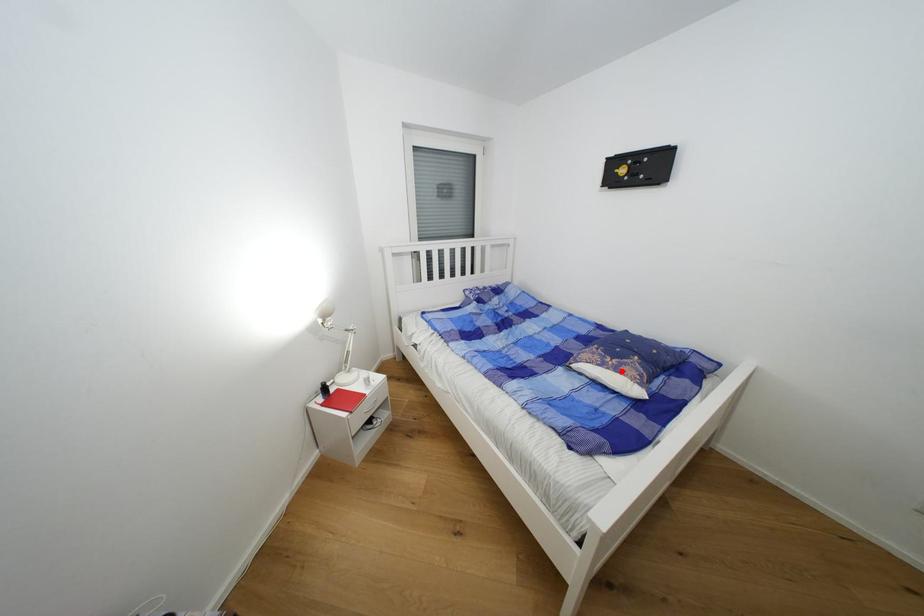
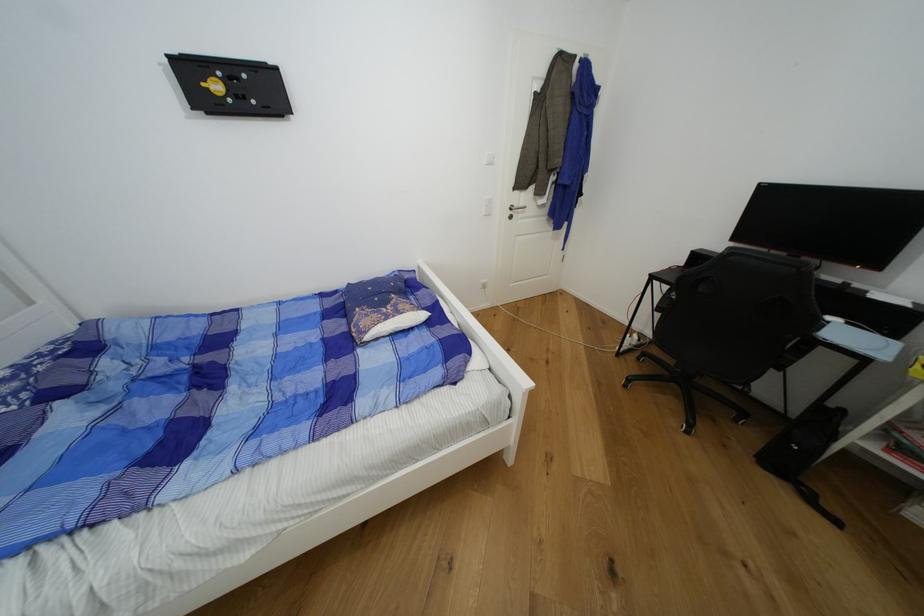
Where in the second image is the point corresponding to the highlighted location from the first image?

(404, 314)